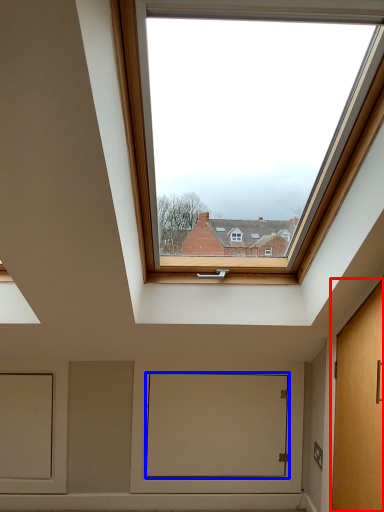
Question: Among these objects, which one is farthest to the camera, door (highlighted by a red box) or window screen (highlighted by a blue box)?

Choices:
 (A) door
 (B) window screen

Answer: (B)